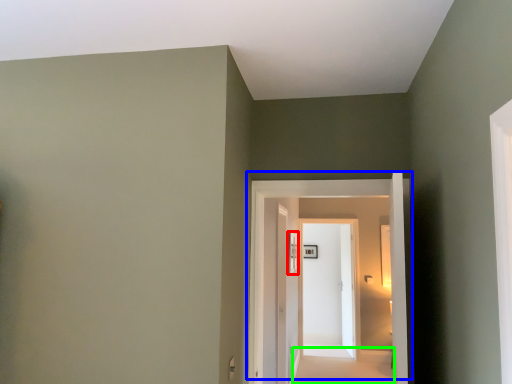
Question: Considering the real-world distances, which object is farthest from window (highlighted by a red box)? door (highlighted by a blue box) or path (highlighted by a green box)?

Choices:
 (A) door
 (B) path

Answer: (B)